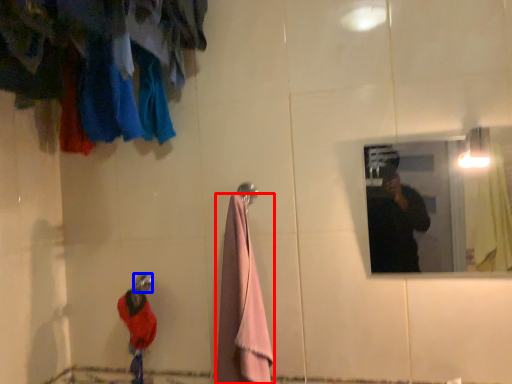
Question: Among these objects, which one is farthest to the camera, towel/napkin (highlighted by a red box) or shower (highlighted by a blue box)?

Choices:
 (A) towel/napkin
 (B) shower

Answer: (B)